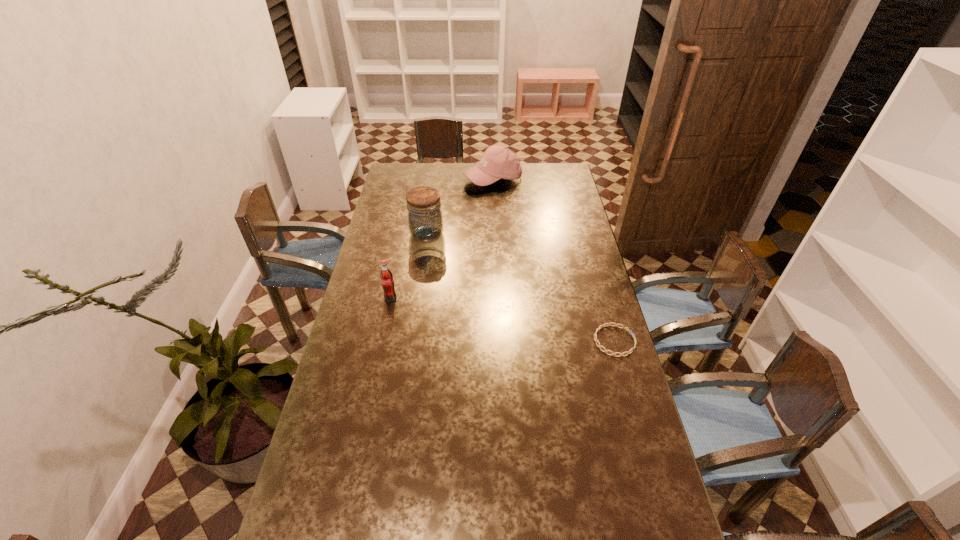
Identify the location of the leftmost object. This screenshot has width=960, height=540. (386, 276).

This screenshot has width=960, height=540. In order to click on the third farthest object in this screenshot , I will do `click(386, 276)`.

At what (x,y) coordinates should I click in order to perform the action: click on the rightmost object. Please return your answer as a coordinate pair (x, y). This screenshot has height=540, width=960. Looking at the image, I should click on 608,324.

Where is `the nearest object`? The image size is (960, 540). the nearest object is located at coordinates (608, 324).

Find the location of a particular element. the third nearest object is located at coordinates (425, 220).

Identify the location of the third object from right to left. (425, 220).

Identify the location of baseball cap. (498, 162).

You are a GUI agent. You are given a task and a screenshot of the screen. Output one action in this format:
    pyautogui.click(x=<x>, y=<y>)
    Task: Click on the farthest object
    The image size is (960, 540).
    Given the screenshot: What is the action you would take?
    [498, 162]

At what (x,y) coordinates should I click in order to perform the action: click on vacant space positioned on the label of the third farthest object. Please return your answer as a coordinate pair (x, y). Looking at the image, I should click on [x=386, y=320].

You are a GUI agent. You are given a task and a screenshot of the screen. Output one action in this format:
    pyautogui.click(x=<x>, y=<y>)
    Task: Click on the free spot located on the lid of the second farthest object
    
    Given the screenshot: What is the action you would take?
    pyautogui.click(x=454, y=268)